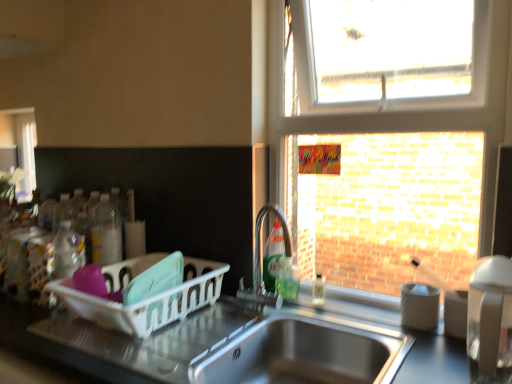
The height and width of the screenshot is (384, 512). In order to click on free point to the right of translucent plastic soap dispenser at sink right, the first bottle when ordered from right to left in this screenshot , I will do `click(356, 302)`.